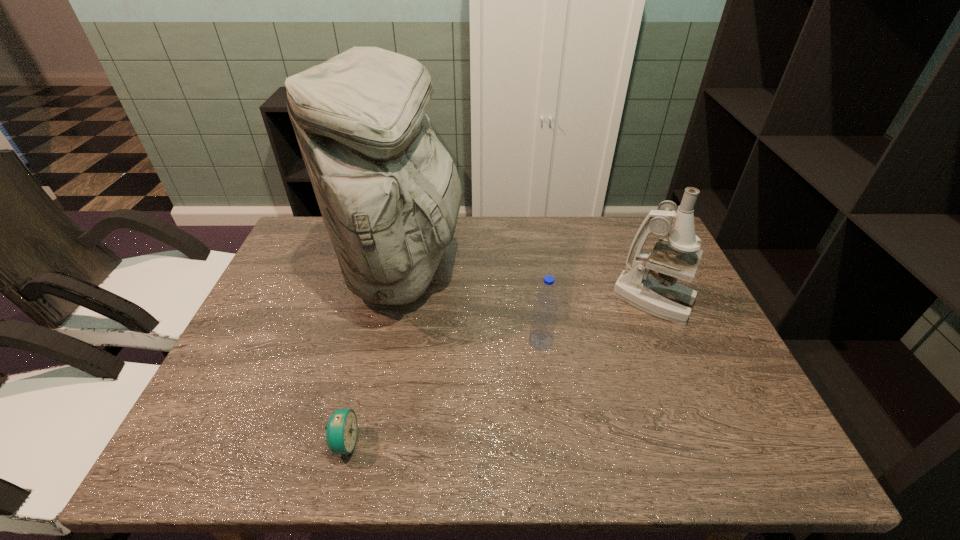
Locate an element on the screen. This screenshot has width=960, height=540. free spot between the shortest object and the rightmost object is located at coordinates (499, 372).

Locate an element on the screen. The image size is (960, 540). empty space that is in between the third shortest object and the second object from right to left is located at coordinates (597, 322).

In order to click on free space between the tallest object and the rightmost object in this screenshot , I will do `click(529, 286)`.

Locate an element on the screen. The image size is (960, 540). vacant point located between the second tallest object and the alarm clock is located at coordinates (499, 372).

Where is `free space between the tallest object and the second tallest object`? free space between the tallest object and the second tallest object is located at coordinates (529, 286).

Locate an element on the screen. unoccupied position between the tallest object and the rightmost object is located at coordinates (529, 286).

Find the location of a particular element. empty space that is in between the tallest object and the nearest object is located at coordinates (373, 357).

The image size is (960, 540). In order to click on unoccupied position between the second object from right to left and the backpack in this screenshot , I will do `click(472, 306)`.

Where is `vacant area between the rightmost object and the alarm clock`? This screenshot has width=960, height=540. vacant area between the rightmost object and the alarm clock is located at coordinates (499, 372).

Select which object appears as the closest to the tallest object. Please provide its 2D coordinates. Your answer should be formatted as a tuple, i.e. [(x, y)], where the tuple contains the x and y coordinates of a point satisfying the conditions above.

[(543, 321)]